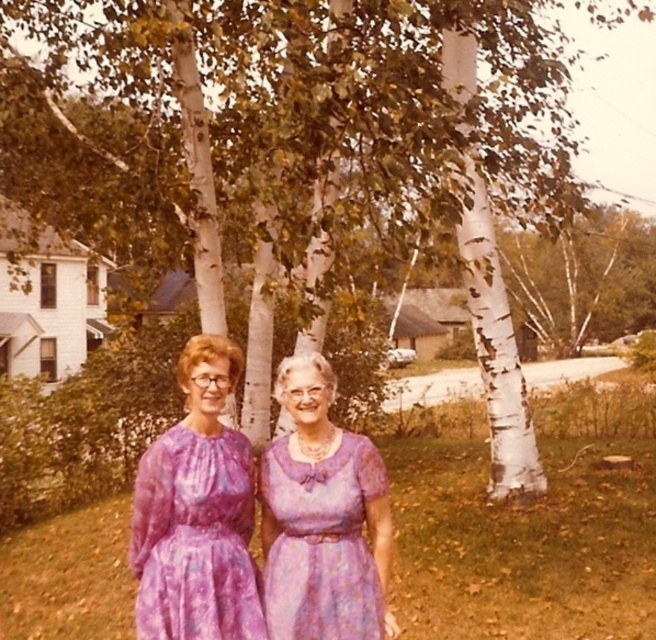
Is purple floral dress at center to the left of purple tie-dye dress at center from the viewer's perspective?

Indeed, purple floral dress at center is positioned on the left side of purple tie-dye dress at center.

Does purple floral dress at center have a smaller size compared to purple tie-dye dress at center?

Actually, purple floral dress at center might be larger than purple tie-dye dress at center.

Which is behind, point (180, 515) or point (331, 468)?

The point (331, 468) is behind.

Where is `purple floral dress at center`? purple floral dress at center is located at coordinates (195, 538).